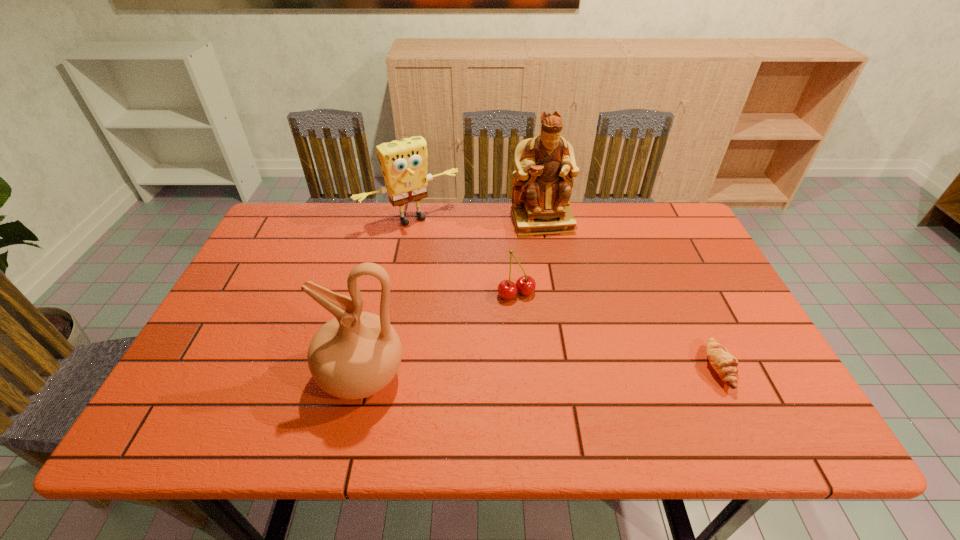
What are the coordinates of `sponge at the far edge` in the screenshot? It's located at (403, 163).

Where is `figurine that is at the far edge`? The image size is (960, 540). figurine that is at the far edge is located at coordinates (545, 165).

Find the location of `pottery that is at the near edge`. pottery that is at the near edge is located at coordinates (356, 354).

Locate an element on the screen. pastry that is at the near edge is located at coordinates point(725,364).

This screenshot has width=960, height=540. I want to click on object at the right edge, so click(x=725, y=364).

You are a GUI agent. You are given a task and a screenshot of the screen. Output one action in this format:
    pyautogui.click(x=<x>, y=<y>)
    Task: Click on the object that is positioned at the near right corner
    
    Given the screenshot: What is the action you would take?
    pyautogui.click(x=725, y=364)

In order to click on free space at the far edge in this screenshot , I will do `click(586, 222)`.

At what (x,y) coordinates should I click in order to perform the action: click on vacant position at the near edge of the desktop. Please return your answer as a coordinate pair (x, y). The image size is (960, 540). Looking at the image, I should click on (439, 383).

In the image, there is a desktop. Where is `vacant space at the left edge`? The width and height of the screenshot is (960, 540). vacant space at the left edge is located at coordinates (234, 343).

Image resolution: width=960 pixels, height=540 pixels. In order to click on blank space at the far left corner of the desktop in this screenshot , I will do `click(277, 242)`.